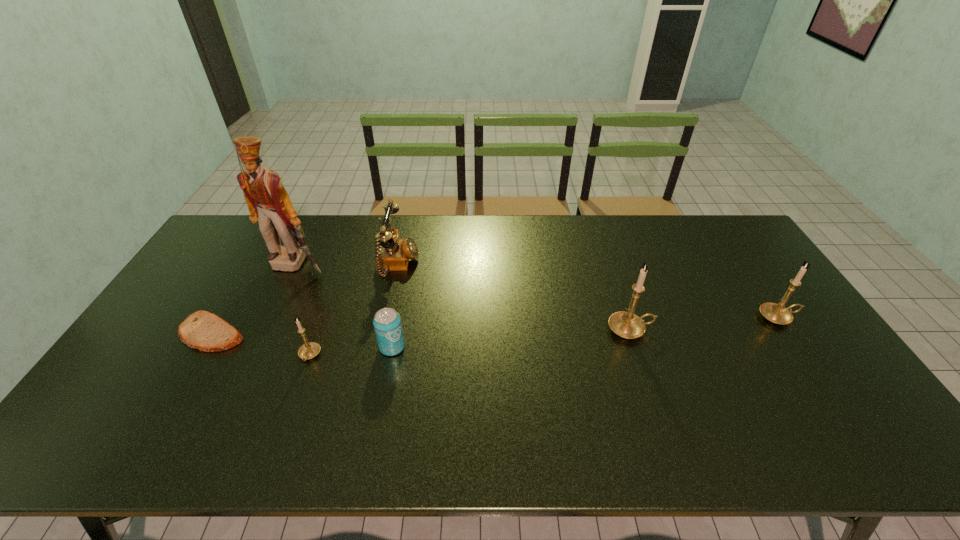
Please point a space for a new candle_holder to maintain equal intervals. Please provide its 2D coordinates. Your answer should be formatted as a tuple, i.e. [(x, y)], where the tuple contains the x and y coordinates of a point satisfying the conditions above.

[(474, 342)]